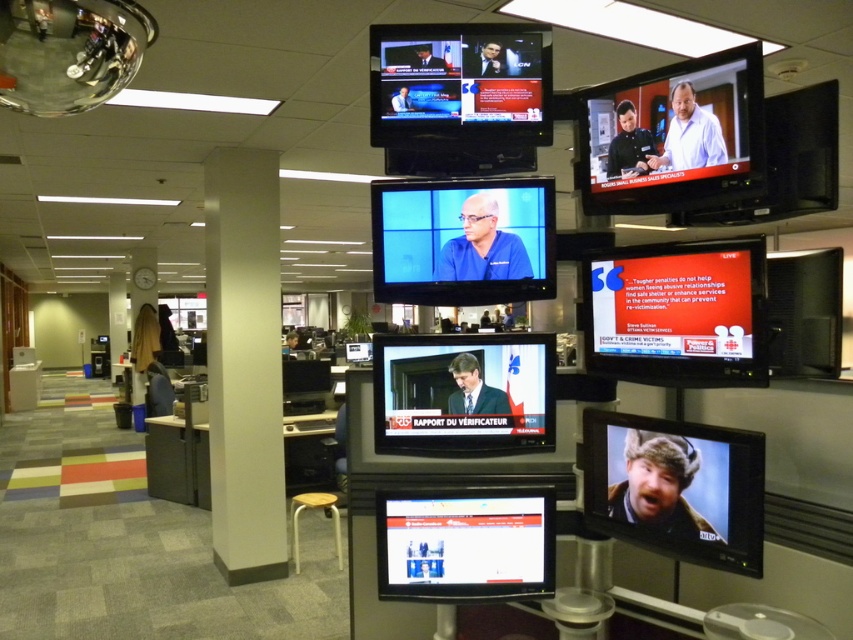
Based on the photo, between white smooth pillar at center and blue fabric screen at center, which one is positioned lower?

Positioned lower is white smooth pillar at center.

Which is behind, point (241, 570) or point (474, 204)?

Positioned behind is point (241, 570).

You are a GUI agent. You are given a task and a screenshot of the screen. Output one action in this format:
    pyautogui.click(x=<x>, y=<y>)
    Task: Click on the white smooth pillar at center
    Image resolution: width=853 pixels, height=640 pixels.
    Given the screenshot: What is the action you would take?
    pyautogui.click(x=244, y=364)

Where is `white smooth pillar at center`? This screenshot has width=853, height=640. white smooth pillar at center is located at coordinates (244, 364).